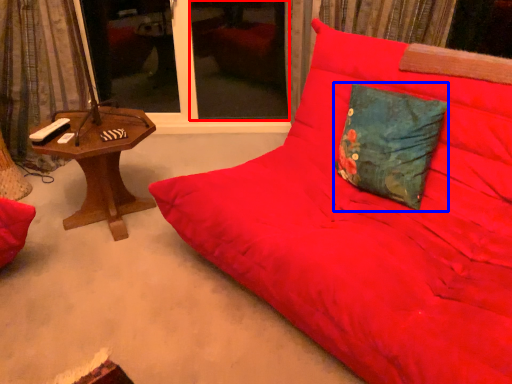
Question: Among these objects, which one is nearest to the camera, window screen (highlighted by a red box) or pillow (highlighted by a blue box)?

Choices:
 (A) window screen
 (B) pillow

Answer: (B)